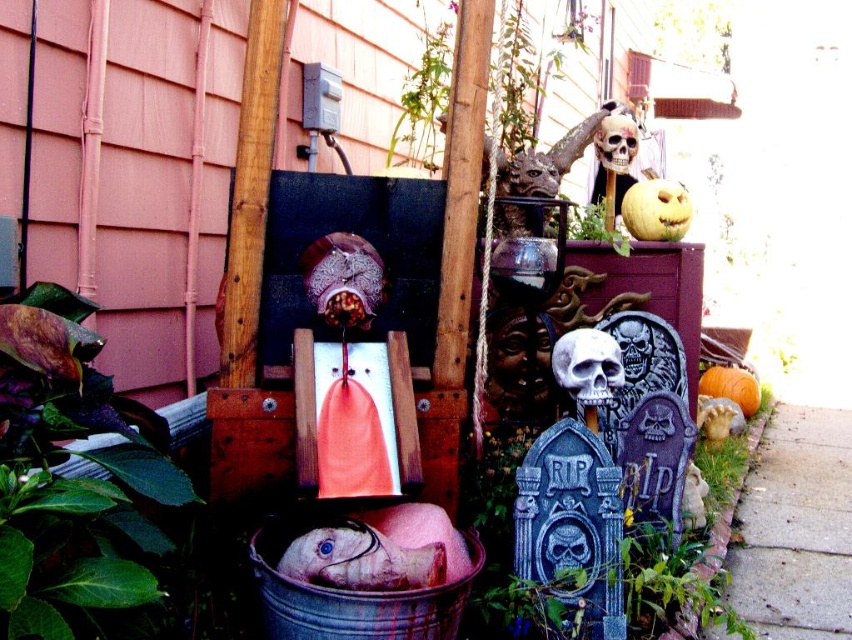
Based on the photo, can you confirm if white matte skull at center is thinner than orange matte pumpkin at lower right?

Indeed, white matte skull at center has a lesser width compared to orange matte pumpkin at lower right.

Is point (579, 371) behind point (752, 380)?

No.

What are the coordinates of `white matte skull at center` in the screenshot? It's located at (586, 365).

Is smooth orange pumpkin at upper right further to the viewer compared to orange matte pumpkin at lower right?

No.

Is point (669, 227) in front of point (746, 404)?

Yes, it is.

Is point (649, 220) more distant than point (701, 378)?

No, it is not.

I want to click on smooth orange pumpkin at upper right, so coord(655,209).

Does smooth orange pumpkin at upper right have a larger size compared to matte plastic skull at upper right?

Correct, smooth orange pumpkin at upper right is larger in size than matte plastic skull at upper right.

Can you confirm if smooth orange pumpkin at upper right is smaller than matte plastic skull at upper right?

No, smooth orange pumpkin at upper right is not smaller than matte plastic skull at upper right.

Between point (675, 216) and point (629, 147), which one is positioned behind?

Point (629, 147)

You are a GUI agent. You are given a task and a screenshot of the screen. Output one action in this format:
    pyautogui.click(x=<x>, y=<y>)
    Task: Click on the smooth orange pumpkin at upper right
    
    Given the screenshot: What is the action you would take?
    pyautogui.click(x=655, y=209)